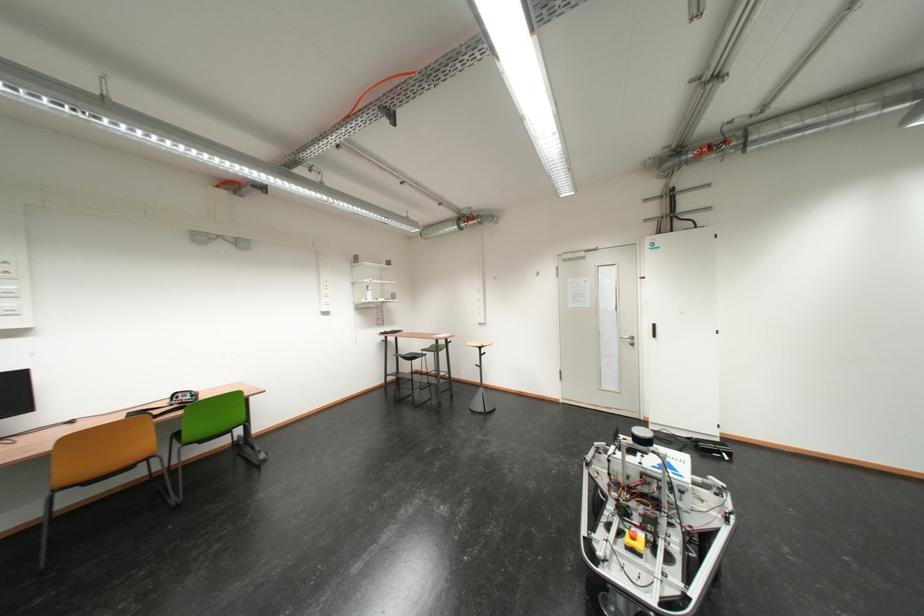
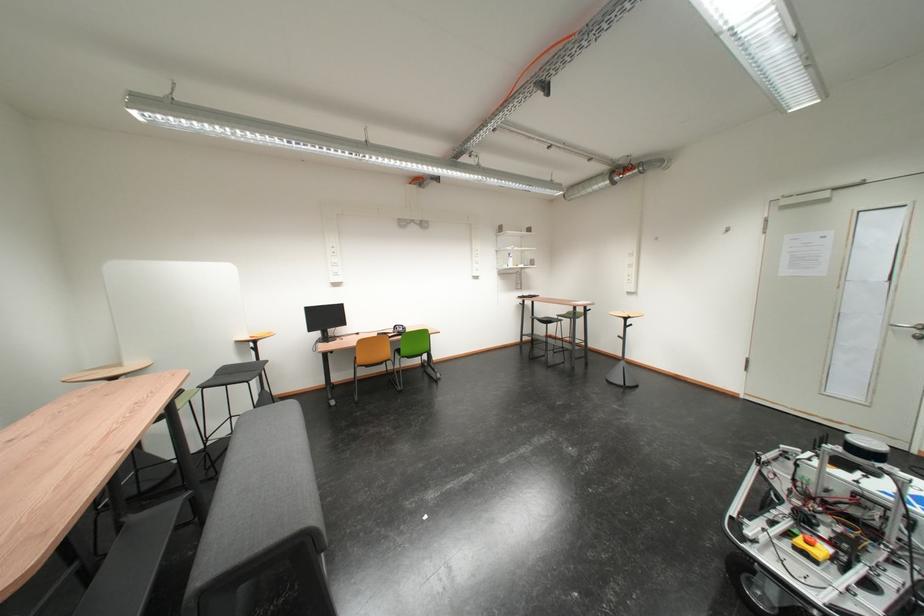
The point at (x=140, y=416) is marked in the first image. Where is the corresponding point in the second image?

(390, 336)